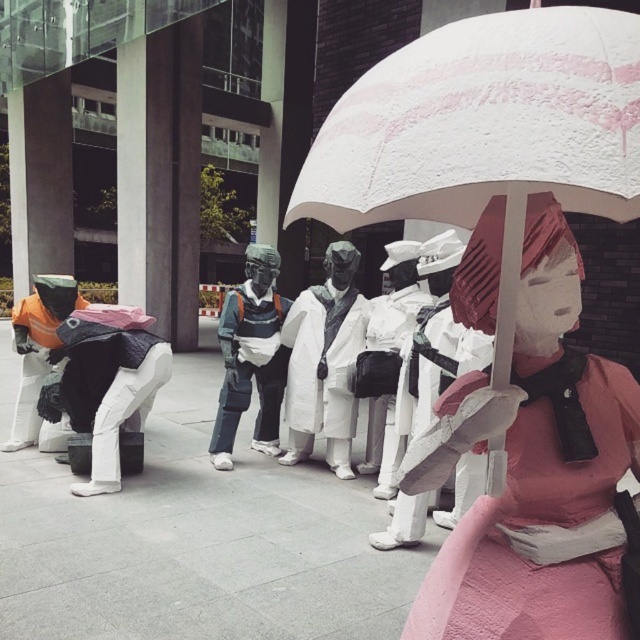
Does point (451, 129) come behind point (296, 353)?

No, (451, 129) is in front of (296, 353).

Who is positioned more to the right, white matte umbrella at center or white matte coat at center?

Positioned to the right is white matte umbrella at center.

The width and height of the screenshot is (640, 640). Find the location of `white matte umbrella at center`. white matte umbrella at center is located at coordinates (484, 132).

Where is `white matte umbrella at center`? Image resolution: width=640 pixels, height=640 pixels. white matte umbrella at center is located at coordinates (484, 132).

Can you confirm if white matte umbrella at center is taller than pink matte umbrella at upper center?

Incorrect, white matte umbrella at center's height is not larger of pink matte umbrella at upper center's.

Is point (480, 150) closer to camera compared to point (611, 580)?

Yes, it is in front of point (611, 580).

Describe the element at coordinates (484, 132) in the screenshot. I see `white matte umbrella at center` at that location.

The image size is (640, 640). I want to click on white matte umbrella at center, so click(x=484, y=132).

From the picture: Is pink matte umbrella at upper center closer to the viewer compared to white matte coat at center?

That is True.

Which is behind, point (525, 490) or point (289, 390)?

Point (289, 390)

Which is in front, point (548, 394) or point (292, 307)?

Point (548, 394) is more forward.

Image resolution: width=640 pixels, height=640 pixels. In order to click on pink matte umbrella at upper center in this screenshot , I will do `click(532, 472)`.